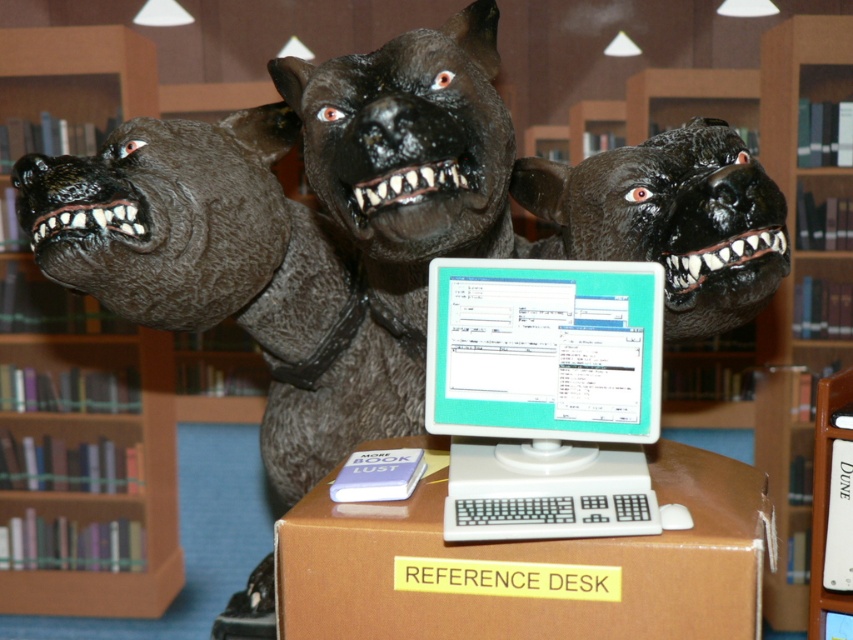
You are a librarian who wants to place a new book on the nearest shelf. Which shelf should you choose between the brown wooden bookshelf at upper center and the wooden bookshelf at left?

The brown wooden bookshelf at upper center is closer to the viewer than the wooden bookshelf at left, so you should place the new book on the brown wooden bookshelf at upper center.

You are a librarian who wants to check the document on the white plastic monitor at center. However, there is a black rubber dog head at center blocking your view. Can you move the dog head to access the monitor?

A: The white plastic monitor at center is located below the black rubber dog head at center, so you can move the black rubber dog head at center to access the white plastic monitor at center.

Looking at this image, you are standing at the library and see two points marked in the image. Which point is closer to you, point (590, 362) or point (659, 145)?

Point (590, 362) is in front of point (659, 145), so it is closer to you.